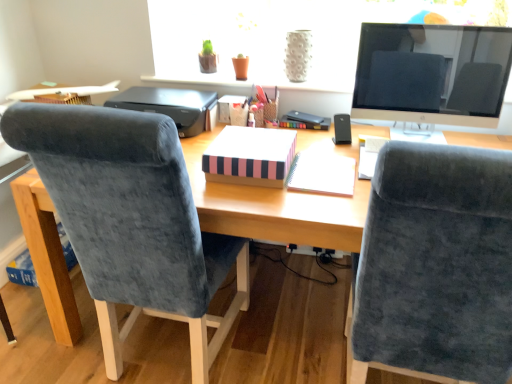
What is the approximate width of velvet blue chair at right, the 1th chair in the right-to-left sequence?

velvet blue chair at right, the 1th chair in the right-to-left sequence, is 26.82 inches wide.

Measure the distance between point (x=138, y=92) and camera.

The depth of point (x=138, y=92) is 2.15 meters.

Measure the distance between velvet blue chair at left, the first chair from the left, and camera.

velvet blue chair at left, the first chair from the left, and camera are 36.20 inches apart from each other.

What is the approximate width of matte black monitor at upper right?

The width of matte black monitor at upper right is 5.50 inches.

Identify the location of velvet blue chair at right, acting as the second chair starting from the left. Image resolution: width=512 pixels, height=384 pixels. (435, 266).

Does matte black monitor at upper right have a lesser width compared to wooden desk at center?

Correct, the width of matte black monitor at upper right is less than that of wooden desk at center.

From the picture: Between matte black monitor at upper right and wooden desk at center, which one is positioned in front?

wooden desk at center is in front.

Between point (451, 30) and point (337, 232), which one is positioned in front?

Point (337, 232)

Does black plastic printer at upper center lie behind matte black monitor at upper right?

Yes, black plastic printer at upper center is further from the camera.

From the picture: Would you say black plastic printer at upper center is outside matte black monitor at upper right?

Yes, black plastic printer at upper center is not within matte black monitor at upper right.

Considering the positions of point (152, 90) and point (407, 83), is point (152, 90) closer or farther from the camera than point (407, 83)?

Point (152, 90) is farther from the camera than point (407, 83).

Is black plastic speaker at right not near wooden desk at center?

No, black plastic speaker at right is not far from wooden desk at center.

Identify the location of desk on the left side of black plastic speaker at right. The width and height of the screenshot is (512, 384). [275, 208].

From the image's perspective, between black plastic speaker at right and wooden desk at center, which one is located above?

black plastic speaker at right appears higher in the image.

Relative to wooden desk at center, is black plastic speaker at right in front or behind?

Visually, black plastic speaker at right is located behind wooden desk at center.

Would you say black plastic printer at upper center is a long distance from velvet blue chair at left, the first chair from the left?

That's not correct — black plastic printer at upper center is a little close to velvet blue chair at left, the first chair from the left.

Who is shorter, black plastic printer at upper center or velvet blue chair at left, the first chair from the left?

Standing shorter between the two is black plastic printer at upper center.

Is black plastic printer at upper center completely or partially outside of velvet blue chair at left, the first chair from the left?

Yes, black plastic printer at upper center is located beyond the bounds of velvet blue chair at left, the first chair from the left.

Which point is more distant from viewer, (185, 130) or (27, 121)?

The point (185, 130) is farther from the camera.

Based on their sizes in the image, would you say matte black monitor at upper right is bigger or smaller than white spiral notebook at center, which is the second notebook from left to right?

In the image, matte black monitor at upper right appears to be larger than white spiral notebook at center, which is the second notebook from left to right.

From a real-world perspective, which object stands above the other?

matte black monitor at upper right, from a real-world perspective.

Is white spiral notebook at center, which is the second notebook from left to right, at the back of matte black monitor at upper right?

That's not correct — matte black monitor at upper right is not looking away from white spiral notebook at center, which is the second notebook from left to right.

Which object is positioned more to the right, matte black monitor at upper right or white spiral notebook at center, which is the second notebook from left to right?

matte black monitor at upper right is more to the right.

Looking at this image, can you confirm if pink striped notebook at center, the first notebook from the left, is taller than black plastic printer at upper center?

In fact, pink striped notebook at center, the first notebook from the left, may be shorter than black plastic printer at upper center.

From the picture: Which is farther from the camera, (228, 174) or (156, 99)?

The point (156, 99) is more distant.

Which is more to the left, pink striped notebook at center, arranged as the second notebook when viewed from the right, or black plastic printer at upper center?

From the viewer's perspective, black plastic printer at upper center appears more on the left side.

Is pink striped notebook at center, the first notebook from the left, smaller than black plastic printer at upper center?

Yes.

From the image's perspective, relative to matte black monitor at upper right, is white spiral notebook at center, which ranks as the first notebook in right-to-left order, above or below?

white spiral notebook at center, which ranks as the first notebook in right-to-left order, is below matte black monitor at upper right.

Can you confirm if white spiral notebook at center, which ranks as the first notebook in right-to-left order, is smaller than matte black monitor at upper right?

Correct, white spiral notebook at center, which ranks as the first notebook in right-to-left order, occupies less space than matte black monitor at upper right.

Does white spiral notebook at center, which ranks as the first notebook in right-to-left order, touch matte black monitor at upper right?

white spiral notebook at center, which ranks as the first notebook in right-to-left order, and matte black monitor at upper right are not in contact.

Is white spiral notebook at center, which ranks as the first notebook in right-to-left order, facing away from matte black monitor at upper right?

No, matte black monitor at upper right is not at the back of white spiral notebook at center, which ranks as the first notebook in right-to-left order.

At what (x,y) coordinates should I click in order to perform the action: click on desk below the matte black monitor at upper right (from the image's perspective). Please return your answer as a coordinate pair (x, y). This screenshot has height=384, width=512. Looking at the image, I should click on (275, 208).

I want to click on printer lying behind the matte black monitor at upper right, so click(170, 106).

Considering their positions, is wooden desk at center positioned further to black plastic printer at upper center than white spiral notebook at center, which ranks as the first notebook in right-to-left order?

Among the two, white spiral notebook at center, which ranks as the first notebook in right-to-left order, is located further to black plastic printer at upper center.

Estimate the real-world distances between objects in this image. Which object is closer to wooden desk at center, velvet blue chair at left, the 2th chair in the right-to-left sequence, or black plastic speaker at right?

The object closer to wooden desk at center is black plastic speaker at right.

Considering their positions, is white spiral notebook at center, which is the second notebook from left to right, positioned further to pink striped notebook at center, arranged as the second notebook when viewed from the right, than wooden desk at center?

white spiral notebook at center, which is the second notebook from left to right, lies further to pink striped notebook at center, arranged as the second notebook when viewed from the right, than the other object.

From the image, which object appears to be farther from black plastic printer at upper center, velvet blue chair at left, the 2th chair in the right-to-left sequence, or wooden desk at center?

velvet blue chair at left, the 2th chair in the right-to-left sequence, is further to black plastic printer at upper center.

Which object lies nearer to the anchor point velvet blue chair at left, the first chair from the left, black plastic speaker at right or black plastic printer at upper center?

black plastic printer at upper center is positioned closer to the anchor velvet blue chair at left, the first chair from the left.

Which object lies further to the anchor point matte black monitor at upper right, black plastic speaker at right or wooden desk at center?

The object further to matte black monitor at upper right is wooden desk at center.

Based on their spatial positions, is white spiral notebook at center, which ranks as the first notebook in right-to-left order, or pink striped notebook at center, the first notebook from the left, further from black plastic speaker at right?

pink striped notebook at center, the first notebook from the left.

In the scene shown: Considering their positions, is black plastic printer at upper center positioned closer to velvet blue chair at left, the 2th chair in the right-to-left sequence, than velvet blue chair at right, acting as the second chair starting from the left?

velvet blue chair at right, acting as the second chair starting from the left.

Identify the location of notebook between velvet blue chair at right, the 1th chair in the right-to-left sequence, and white spiral notebook at center, which is the second notebook from left to right, from front to back. This screenshot has width=512, height=384. (250, 156).

At what (x,y) coordinates should I click in order to perform the action: click on desk located between velvet blue chair at right, the 1th chair in the right-to-left sequence, and white spiral notebook at center, which is the second notebook from left to right, in the depth direction. Please return your answer as a coordinate pair (x, y). Image resolution: width=512 pixels, height=384 pixels. Looking at the image, I should click on (275, 208).

Locate an element on the screen. This screenshot has height=384, width=512. speaker positioned between velvet blue chair at right, the 1th chair in the right-to-left sequence, and black plastic printer at upper center from near to far is located at coordinates (342, 129).

At what (x,y) coordinates should I click in order to perform the action: click on desk between black plastic printer at upper center and black plastic speaker at right in the horizontal direction. Please return your answer as a coordinate pair (x, y). The width and height of the screenshot is (512, 384). Looking at the image, I should click on (275, 208).